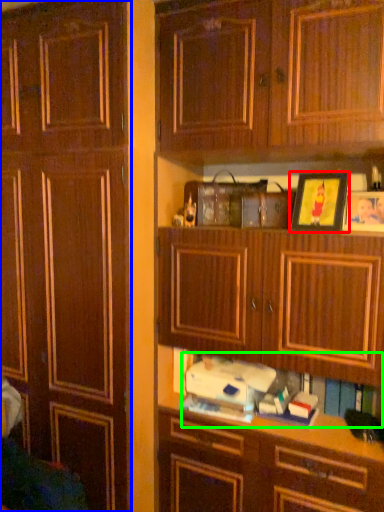
Question: Considering the real-world distances, which object is farthest from picture frame (highlighted by a red box)? cabinetry (highlighted by a blue box) or book (highlighted by a green box)?

Choices:
 (A) cabinetry
 (B) book

Answer: (A)